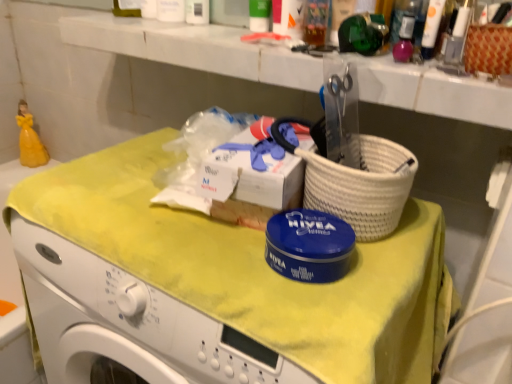
Locate an element on the screen. This screenshot has height=384, width=512. vacant area that is in front of white plastic container at upper center, which appears as the 3th toiletry when viewed from the right is located at coordinates (202, 30).